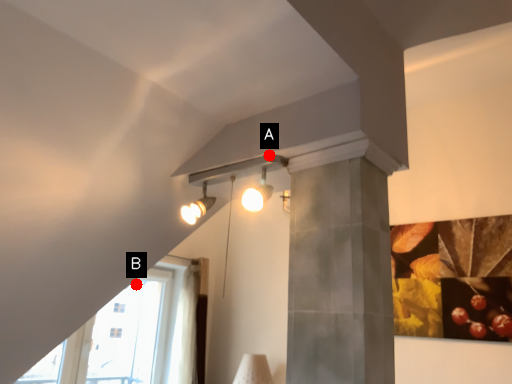
Question: Two points are circled on the image, labeled by A and B beside each circle. Which point is closer to the camera taking this photo?

Choices:
 (A) A is closer
 (B) B is closer

Answer: (A)